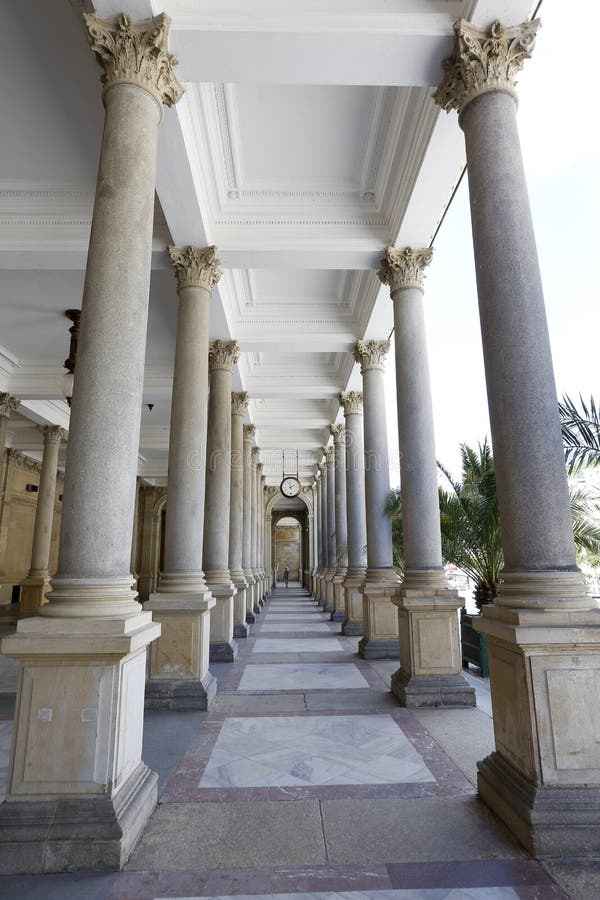
Locate an element on the screen. This screenshot has width=600, height=900. hanging clock is located at coordinates (287, 489).